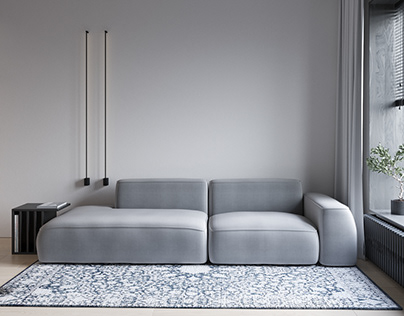
Image resolution: width=404 pixels, height=316 pixels. I want to click on end table, so click(x=32, y=212).